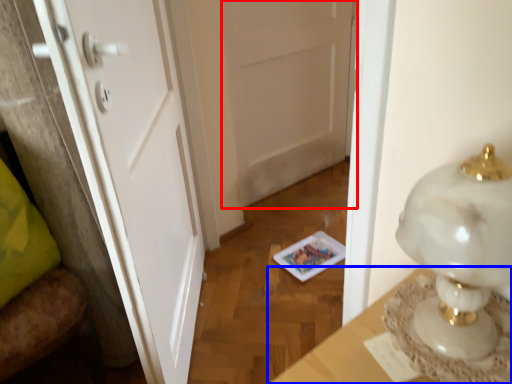
Question: Which point is closer to the camera, door (highlighted by a red box) or table (highlighted by a blue box)?

Choices:
 (A) door
 (B) table

Answer: (B)